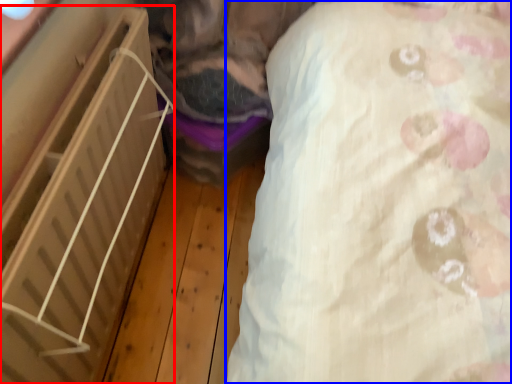
Question: Which object appears farthest to the camera in this image, furniture (highlighted by a red box) or sheet (highlighted by a blue box)?

Choices:
 (A) furniture
 (B) sheet

Answer: (A)